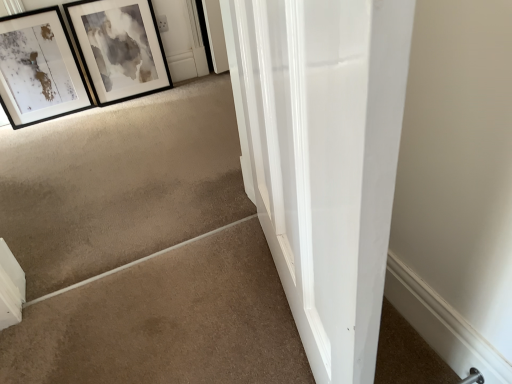
Question: Considering the relative sizes of beige carpet at lower left and matte black picture frame at upper left, which is the first picture frame from left to right, in the image provided, is beige carpet at lower left smaller than matte black picture frame at upper left, which is the first picture frame from left to right,?

Choices:
 (A) no
 (B) yes

Answer: (A)

Question: Is matte black picture frame at upper left, which is the first picture frame from left to right, a part of beige carpet at lower left?

Choices:
 (A) yes
 (B) no

Answer: (B)

Question: Is beige carpet at lower left in front of matte black picture frame at upper left, which is the first picture frame from left to right?

Choices:
 (A) no
 (B) yes

Answer: (B)

Question: Does beige carpet at lower left have a greater height compared to matte black picture frame at upper left, which is the first picture frame from left to right?

Choices:
 (A) yes
 (B) no

Answer: (B)

Question: Considering the relative sizes of beige carpet at lower left and matte black picture frame at upper left, which is the first picture frame from left to right, in the image provided, is beige carpet at lower left wider than matte black picture frame at upper left, which is the first picture frame from left to right,?

Choices:
 (A) yes
 (B) no

Answer: (A)

Question: Is beige carpet at lower left taller or shorter than black matte picture frame at upper left, which is counted as the first picture frame, starting from the right?

Choices:
 (A) short
 (B) tall

Answer: (A)

Question: Considering the positions of point (219, 377) and point (104, 24), is point (219, 377) closer or farther from the camera than point (104, 24)?

Choices:
 (A) farther
 (B) closer

Answer: (B)

Question: In terms of size, does beige carpet at lower left appear bigger or smaller than black matte picture frame at upper left, which is counted as the first picture frame, starting from the right?

Choices:
 (A) small
 (B) big

Answer: (B)

Question: Considering their positions, is beige carpet at lower left located in front of or behind black matte picture frame at upper left, marked as the second picture frame in a left-to-right arrangement?

Choices:
 (A) front
 (B) behind

Answer: (A)

Question: From a real-world perspective, is black matte picture frame at upper left, which is counted as the first picture frame, starting from the right, physically located above or below beige carpet at lower left?

Choices:
 (A) above
 (B) below

Answer: (A)

Question: In terms of size, does black matte picture frame at upper left, marked as the second picture frame in a left-to-right arrangement, appear bigger or smaller than beige carpet at lower left?

Choices:
 (A) small
 (B) big

Answer: (A)

Question: Considering the positions of black matte picture frame at upper left, marked as the second picture frame in a left-to-right arrangement, and beige carpet at lower left in the image, is black matte picture frame at upper left, marked as the second picture frame in a left-to-right arrangement, taller or shorter than beige carpet at lower left?

Choices:
 (A) tall
 (B) short

Answer: (A)

Question: Is black matte picture frame at upper left, which is counted as the first picture frame, starting from the right, inside or outside of beige carpet at lower left?

Choices:
 (A) outside
 (B) inside

Answer: (A)

Question: Looking at the image, does beige carpet at lower left seem bigger or smaller compared to matte black picture frame at upper left, which is the 2th picture frame in right-to-left order?

Choices:
 (A) small
 (B) big

Answer: (B)

Question: Considering the positions of point (93, 329) and point (2, 51), is point (93, 329) closer or farther from the camera than point (2, 51)?

Choices:
 (A) closer
 (B) farther

Answer: (A)